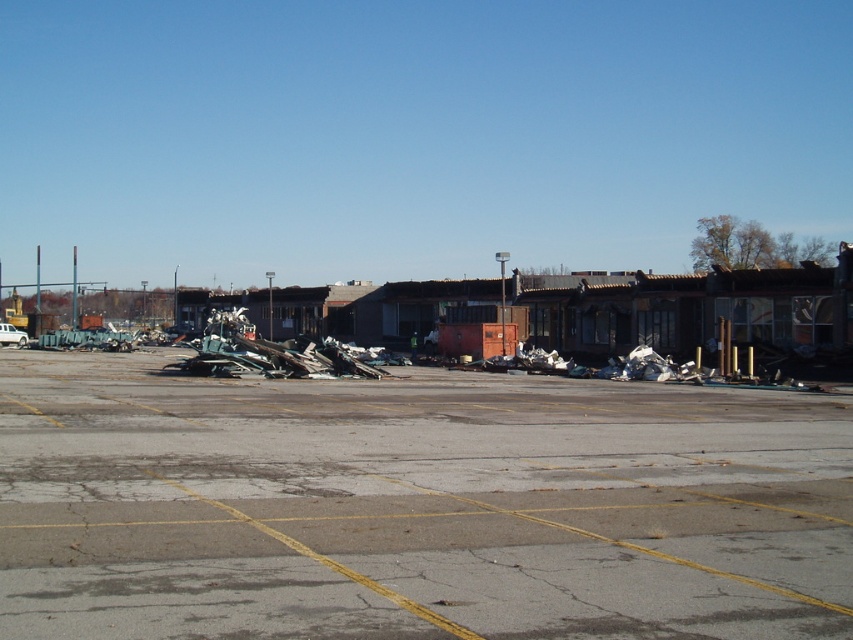
Question: Can you confirm if gray asphalt parking lot at center is positioned to the left of white matte truck at center?

Choices:
 (A) yes
 (B) no

Answer: (B)

Question: From the image, what is the correct spatial relationship of gray asphalt parking lot at center in relation to white matte truck at center?

Choices:
 (A) below
 (B) above

Answer: (A)

Question: Which point appears closest to the camera in this image?

Choices:
 (A) (395, 577)
 (B) (13, 332)

Answer: (A)

Question: Which of the following is the closest to the observer?

Choices:
 (A) gray asphalt parking lot at center
 (B) white matte truck at center

Answer: (A)

Question: Is gray asphalt parking lot at center smaller than white matte truck at center?

Choices:
 (A) yes
 (B) no

Answer: (B)

Question: Which point is farther to the camera?

Choices:
 (A) (57, 458)
 (B) (12, 330)

Answer: (B)